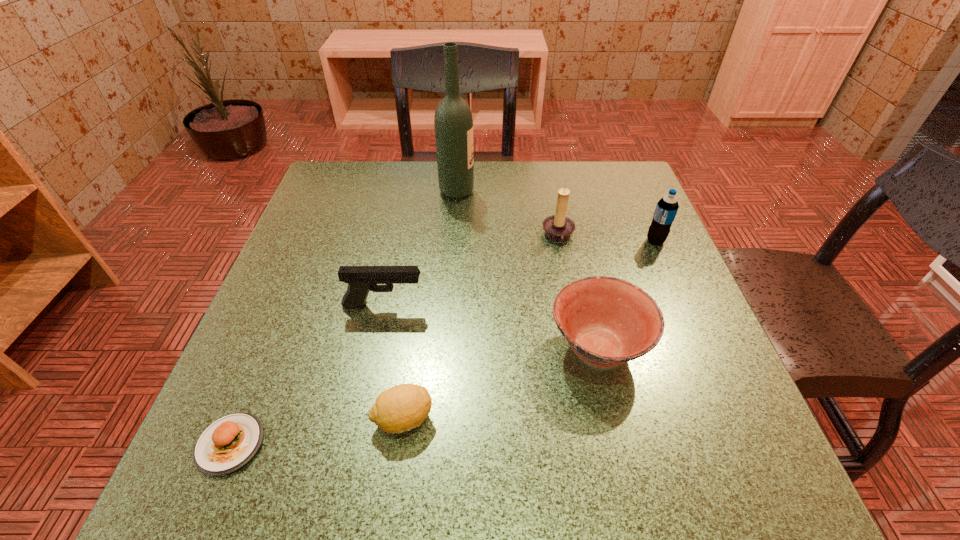
Locate an element on the screen. Image resolution: width=960 pixels, height=540 pixels. free region located 0.260m on the left of the rightmost object is located at coordinates (529, 241).

This screenshot has width=960, height=540. Identify the location of free space located 0.270m on the wick of the candle holder. tap(422, 236).

I want to click on free space located 0.380m on the wick of the candle holder, so click(374, 236).

At what (x,y) coordinates should I click in order to perform the action: click on vacant area located on the wick of the candle holder. Please return your answer as a coordinate pair (x, y). The image size is (960, 540). Looking at the image, I should click on (493, 236).

Where is `free spot located on the front-facing side of the pistol`? This screenshot has width=960, height=540. free spot located on the front-facing side of the pistol is located at coordinates (549, 306).

The height and width of the screenshot is (540, 960). In order to click on vacant area located on the back of the fifth farthest object in this screenshot , I will do `click(566, 212)`.

Locate an element on the screen. The height and width of the screenshot is (540, 960). vacant space located 0.400m at the stem end of the sixth tallest object is located at coordinates (691, 419).

Locate an element on the screen. vacant region located on the right of the food is located at coordinates (465, 444).

Identify the location of object that is at the far edge. This screenshot has height=540, width=960. (453, 122).

Locate an element on the screen. The height and width of the screenshot is (540, 960). lemon present at the near edge is located at coordinates (403, 407).